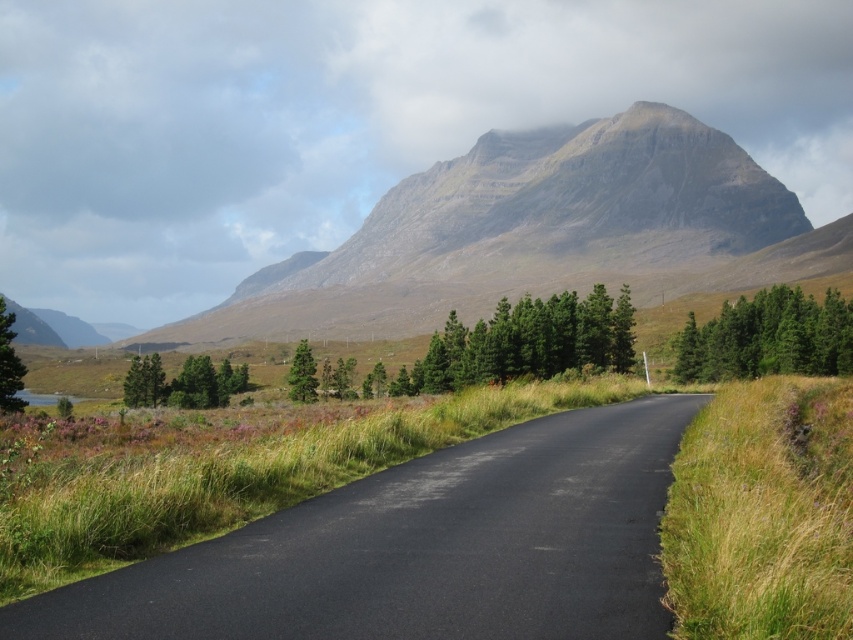
Question: Considering the relative positions of green textured trees at left and green matte tree at left in the image provided, where is green textured trees at left located with respect to green matte tree at left?

Choices:
 (A) below
 (B) above

Answer: (A)

Question: Is black asphalt road at center behind green matte tree at center?

Choices:
 (A) no
 (B) yes

Answer: (A)

Question: Which point appears closest to the camera in this image?

Choices:
 (A) (369, 248)
 (B) (735, 376)

Answer: (B)

Question: Among these objects, which one is farthest from the camera?

Choices:
 (A) green textured trees at left
 (B) rugged granite mountain at upper center
 (C) green matte tree at center

Answer: (B)

Question: Which of the following is the closest to the observer?

Choices:
 (A) green matte tree at center
 (B) green matte trees at center

Answer: (B)

Question: Can you confirm if black asphalt road at center is smaller than rugged granite mountain at upper center?

Choices:
 (A) yes
 (B) no

Answer: (A)